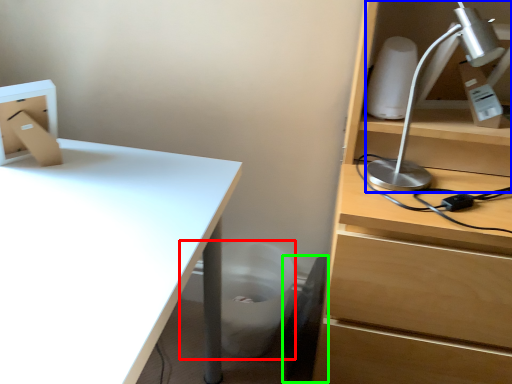
Question: Considering the real-world distances, which object is farthest from trash bin/can (highlighted by a red box)? lamp (highlighted by a blue box) or swivel chair (highlighted by a green box)?

Choices:
 (A) lamp
 (B) swivel chair

Answer: (A)